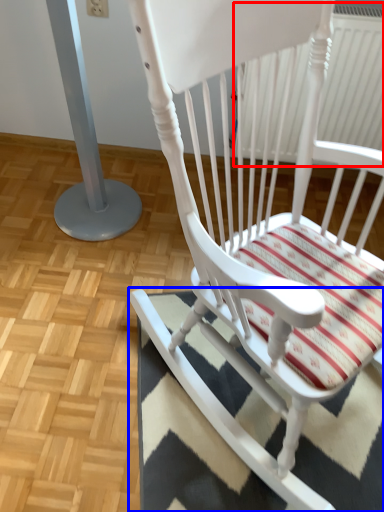
Question: Which object appears farthest to the camera in this image, radiator (highlighted by a red box) or doormat (highlighted by a blue box)?

Choices:
 (A) radiator
 (B) doormat

Answer: (A)